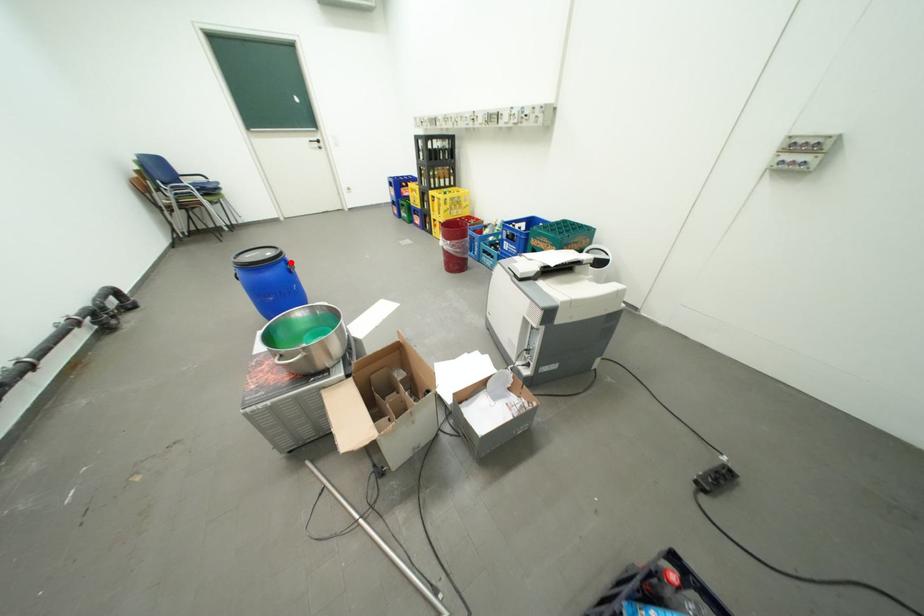
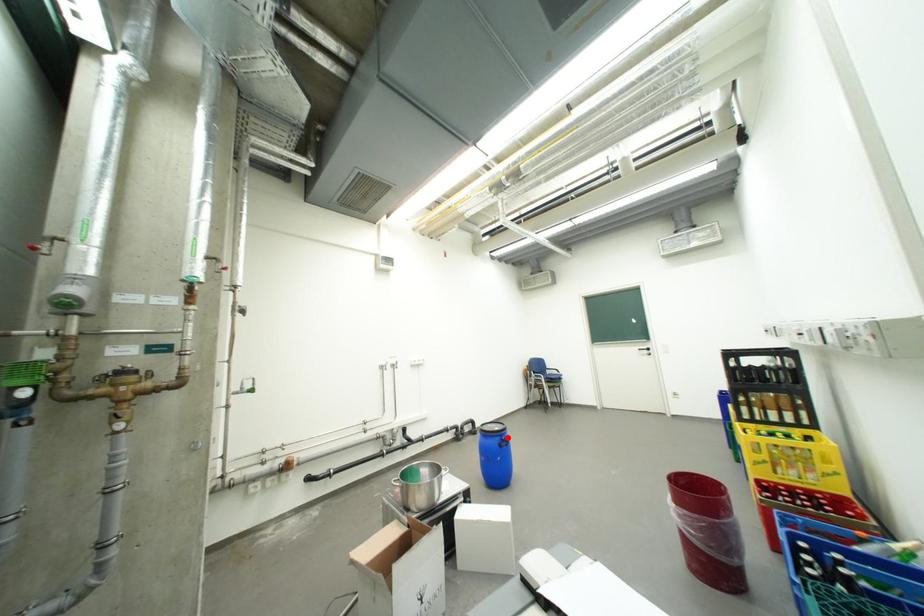
I am providing you with two images of the same scene from different viewpoints. A red point is marked on the first image and another point is marked on the second image. Does the point marked in image1 correspond to the same location as the one in image2?

Yes